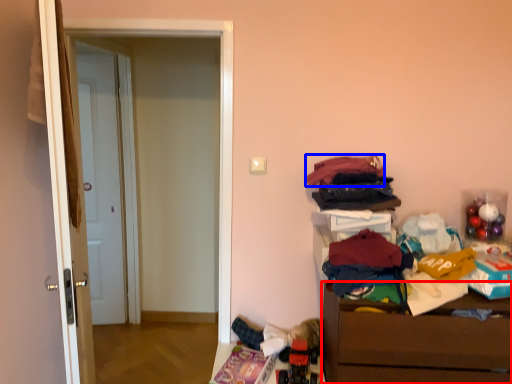
Question: Which point is closer to the camera, chest of drawers (highlighted by a red box) or clothing (highlighted by a blue box)?

Choices:
 (A) chest of drawers
 (B) clothing

Answer: (A)